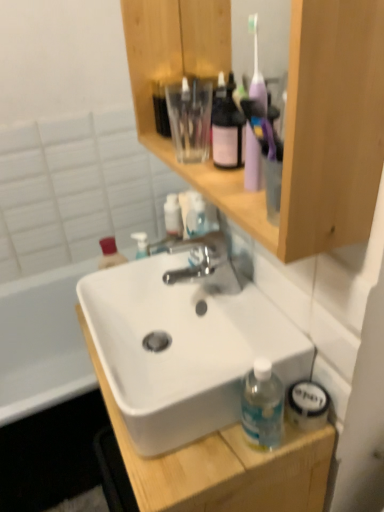
Question: Is polished chrome faucet at center located outside wooden cabinet at upper center?

Choices:
 (A) yes
 (B) no

Answer: (A)

Question: Is polished chrome faucet at center bigger than wooden cabinet at upper center?

Choices:
 (A) yes
 (B) no

Answer: (B)

Question: Is wooden cabinet at upper center inside polished chrome faucet at center?

Choices:
 (A) no
 (B) yes

Answer: (A)

Question: Is the position of polished chrome faucet at center more distant than that of wooden cabinet at upper center?

Choices:
 (A) no
 (B) yes

Answer: (B)

Question: Considering the relative sizes of polished chrome faucet at center and wooden cabinet at upper center in the image provided, is polished chrome faucet at center smaller than wooden cabinet at upper center?

Choices:
 (A) no
 (B) yes

Answer: (B)

Question: In terms of height, does wooden cabinet at upper center look taller or shorter compared to white matte sink at center?

Choices:
 (A) tall
 (B) short

Answer: (B)

Question: From the image's perspective, is wooden cabinet at upper center positioned above or below white matte sink at center?

Choices:
 (A) below
 (B) above

Answer: (B)

Question: From a real-world perspective, is wooden cabinet at upper center physically located above or below white matte sink at center?

Choices:
 (A) above
 (B) below

Answer: (A)

Question: In terms of size, does wooden cabinet at upper center appear bigger or smaller than white matte sink at center?

Choices:
 (A) big
 (B) small

Answer: (B)

Question: Does point (158, 493) appear closer or farther from the camera than point (210, 266)?

Choices:
 (A) farther
 (B) closer

Answer: (B)

Question: Is white matte sink at center situated inside polished chrome faucet at center or outside?

Choices:
 (A) inside
 (B) outside

Answer: (B)

Question: Is white matte sink at center taller or shorter than polished chrome faucet at center?

Choices:
 (A) tall
 (B) short

Answer: (A)

Question: From a real-world perspective, is white matte sink at center above or below polished chrome faucet at center?

Choices:
 (A) below
 (B) above

Answer: (A)

Question: Considering the positions of polished chrome faucet at center and white matte sink at center in the image, is polished chrome faucet at center wider or thinner than white matte sink at center?

Choices:
 (A) wide
 (B) thin

Answer: (B)

Question: Is polished chrome faucet at center taller or shorter than white matte sink at center?

Choices:
 (A) short
 (B) tall

Answer: (A)